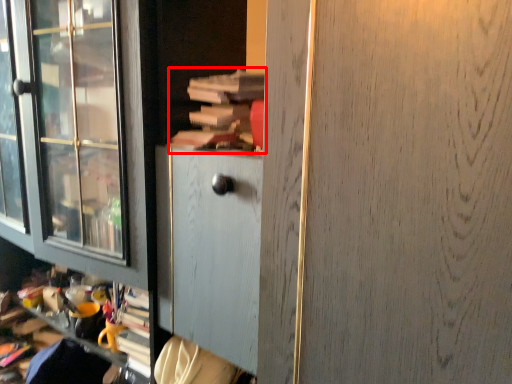
Question: From the image's perspective, what is the correct spatial positioning of book (annotated by the red box) in reference to screen door?

Choices:
 (A) above
 (B) below

Answer: (A)